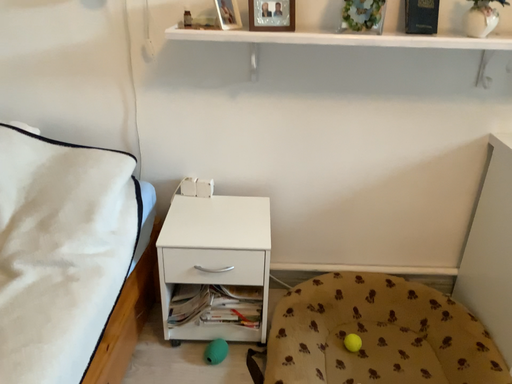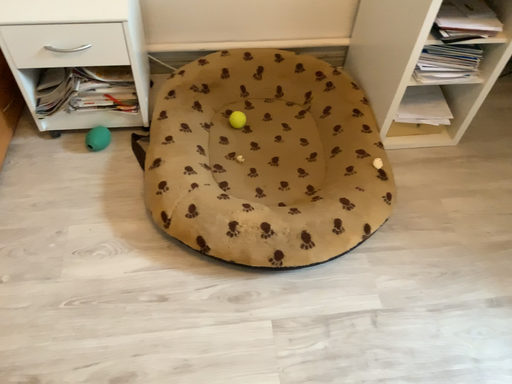
Question: Which way did the camera rotate in the video?

Choices:
 (A) rotated right
 (B) rotated left

Answer: (A)